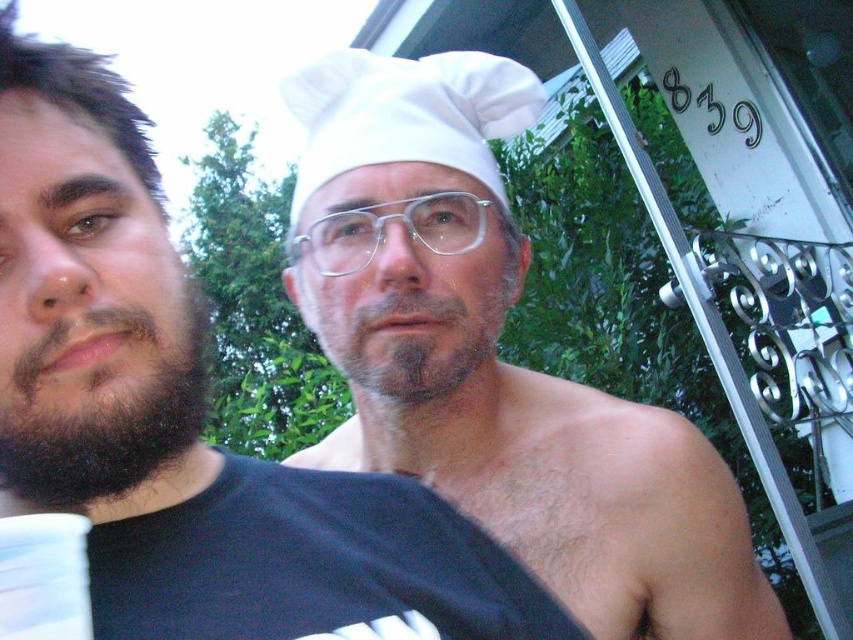
This screenshot has width=853, height=640. Describe the element at coordinates (88, 291) in the screenshot. I see `dark brown hair at left` at that location.

Describe the element at coordinates (88, 291) in the screenshot. I see `dark brown hair at left` at that location.

Locate an element on the screen. The image size is (853, 640). dark brown hair at left is located at coordinates (88, 291).

Can you confirm if white fabric chef hat at center is positioned to the right of gray matte beard at center?

Indeed, white fabric chef hat at center is positioned on the right side of gray matte beard at center.

Between white fabric chef hat at center and gray matte beard at center, which one has less height?

gray matte beard at center is shorter.

Is point (532, 522) in front of point (360, 301)?

No, it is behind (360, 301).

In order to click on white fabric chef hat at center in this screenshot , I will do `click(492, 356)`.

Which is behind, point (113, 346) or point (376, 404)?

The point (376, 404) is more distant.

The width and height of the screenshot is (853, 640). Describe the element at coordinates (187, 416) in the screenshot. I see `white matte chef hat at center` at that location.

You are a GUI agent. You are given a task and a screenshot of the screen. Output one action in this format:
    pyautogui.click(x=<x>, y=<y>)
    Task: Click on the white matte chef hat at center
    The height and width of the screenshot is (640, 853).
    Given the screenshot: What is the action you would take?
    pyautogui.click(x=187, y=416)